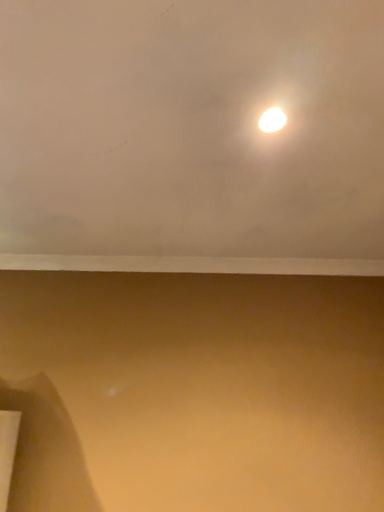
The height and width of the screenshot is (512, 384). I want to click on white matte ceiling at upper center, so click(x=192, y=128).

This screenshot has height=512, width=384. Describe the element at coordinates (192, 128) in the screenshot. I see `white matte ceiling at upper center` at that location.

Measure the distance between white matte ceiling at upper center and camera.

25.13 inches.

Locate an element on the screen. white matte ceiling at upper center is located at coordinates (192, 128).